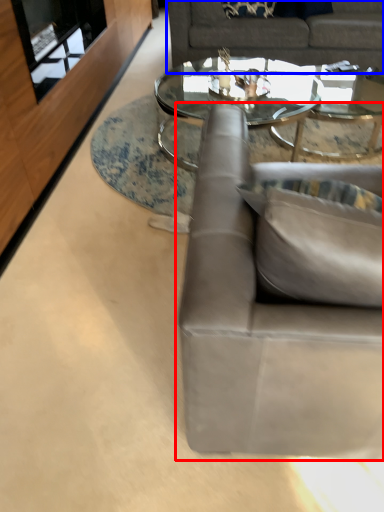
Question: Among these objects, which one is nearest to the camera, studio couch (highlighted by a red box) or studio couch (highlighted by a blue box)?

Choices:
 (A) studio couch
 (B) studio couch

Answer: (A)